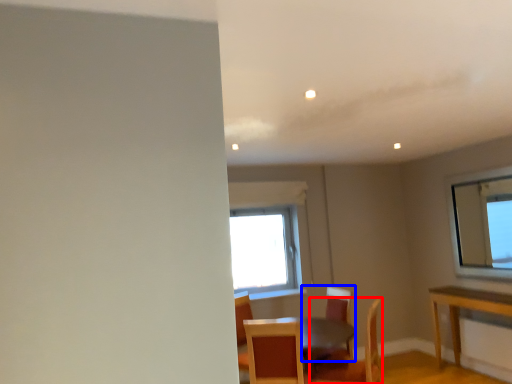
Question: Which point is further to the camera, chair (highlighted by a red box) or chair (highlighted by a blue box)?

Choices:
 (A) chair
 (B) chair

Answer: (B)